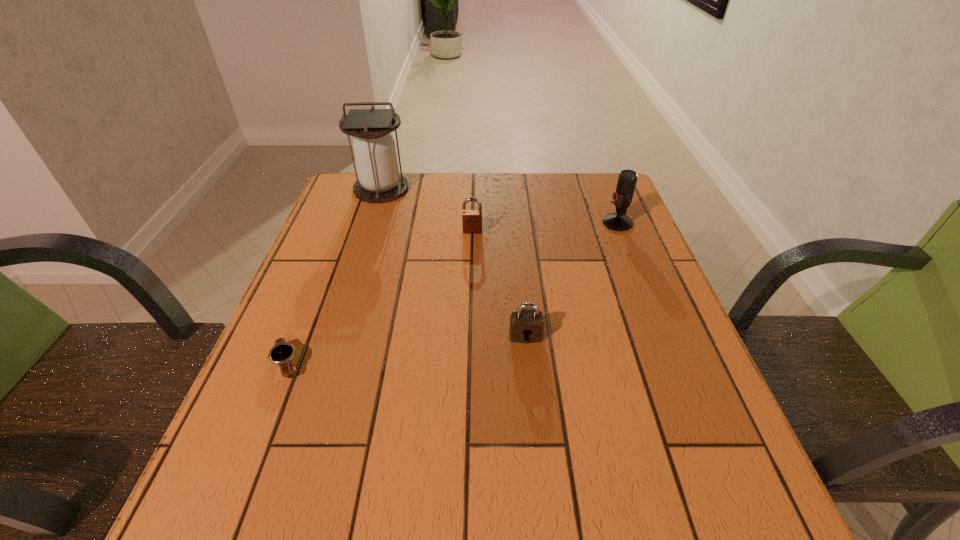
Identify which object is the closest to the left padlock. Please provide its 2D coordinates. Your answer should be formatted as a tuple, i.e. [(x, y)], where the tuple contains the x and y coordinates of a point satisfying the conditions above.

[(379, 181)]

This screenshot has height=540, width=960. I want to click on vacant space that satisfies the following two spatial constraints: 1. on the back side of the nearest object; 2. on the left side of the farthest object, so click(356, 189).

Identify the location of vacant space that satisfies the following two spatial constraints: 1. on the side of the second tallest object with the red ring; 2. at the front of the fourth farthest object near the keyhole. (662, 336).